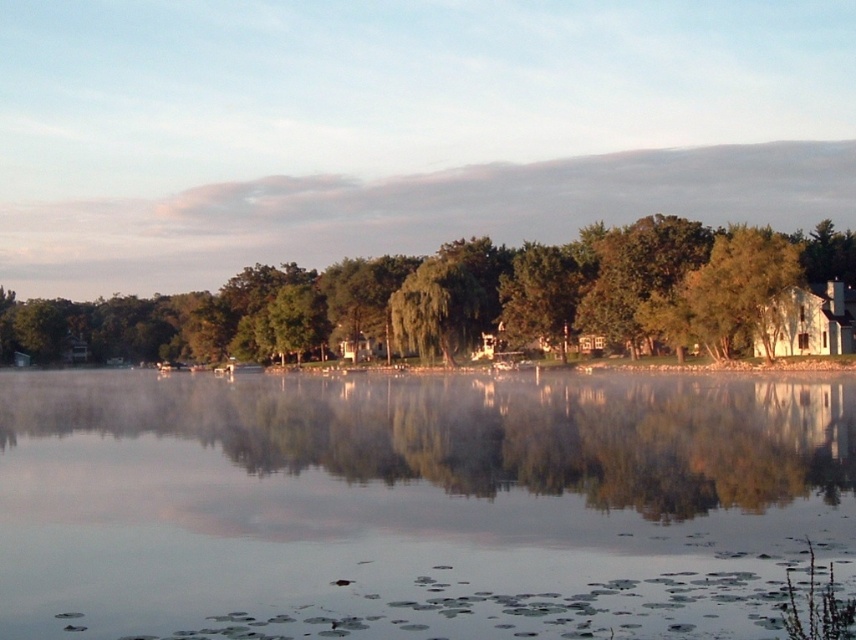
You are standing at the edge of the lake and want to walk across the transparent water at center to reach the green leafy tree at lower left. Considering the width of the water and the tree, can you safely walk across the water to the tree?

The transparent water at center has a width less than the green leafy tree at lower left, but since water is liquid, you cannot walk across it regardless of its width. You would need a boat or another means to reach the green leafy tree at lower left.

You are standing at the edge of the lake and want to take a photo of the transparent water at center. Where should you position your camera to capture it best?

The transparent water at center is located at coordinates point (415, 502), so position your camera there for the best capture.

You are a photographer planning to capture the white translucent fog at upper center and the green leafy tree at lower left in the same frame. Given that your camera has a maximum focus range of 400 feet, will you be able to focus both objects simultaneously?

The distance between the white translucent fog at upper center and the green leafy tree at lower left is 422.10 feet. Since the camera can only focus up to 400 feet, the objects are beyond the maximum focus range, so you won